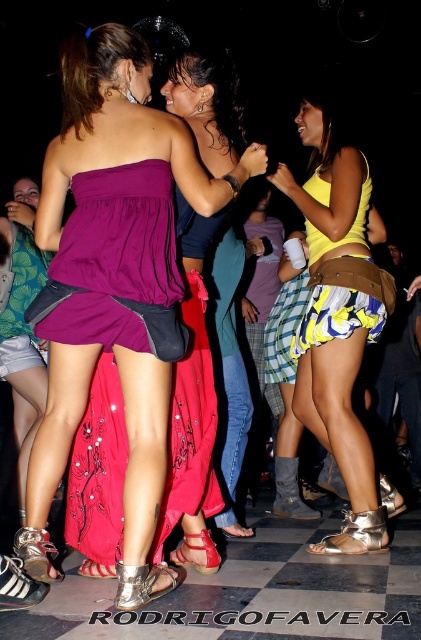
Question: Which point is farther to the camera?

Choices:
 (A) (84, 240)
 (B) (119, 300)
 (C) (199, 400)
 (D) (356, 324)

Answer: (D)

Question: Is the position of matte purple dress at center more distant than that of yellow printed fabric skirt at center?

Choices:
 (A) yes
 (B) no

Answer: (B)

Question: Is matte purple dress at center bigger than shiny purple dress at center?

Choices:
 (A) yes
 (B) no

Answer: (A)

Question: Among these objects, which one is nearest to the camera?

Choices:
 (A) yellow matte tank top at center
 (B) matte purple dress at center
 (C) yellow printed fabric skirt at center
 (D) purple satin dress at center

Answer: (B)

Question: Which point appears farthest from the camera in this image?

Choices:
 (A) tap(39, 243)
 (B) tap(202, 438)
 (C) tap(162, 193)

Answer: (B)

Question: In this image, where is matte purple dress at center located relative to yellow printed fabric skirt at center?

Choices:
 (A) below
 (B) above

Answer: (A)